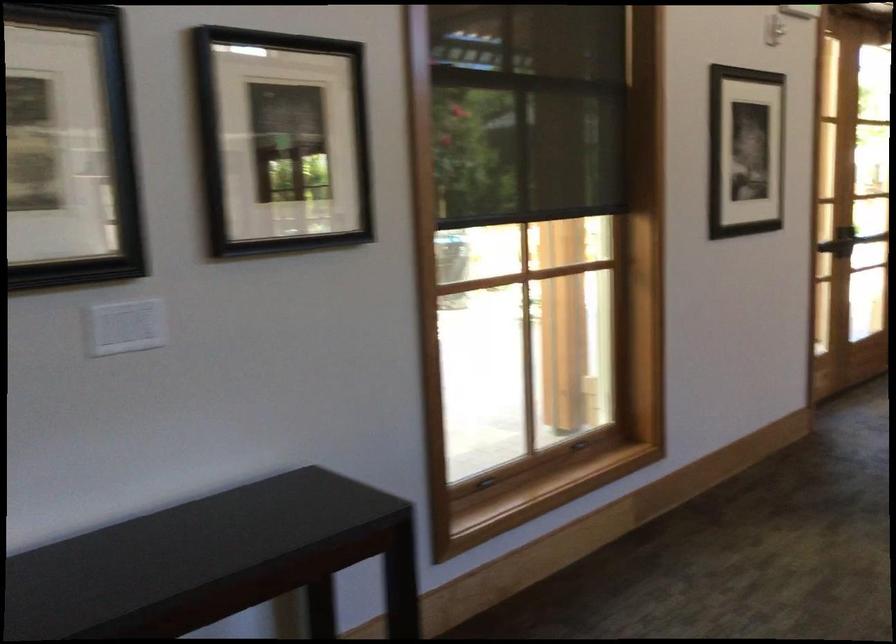
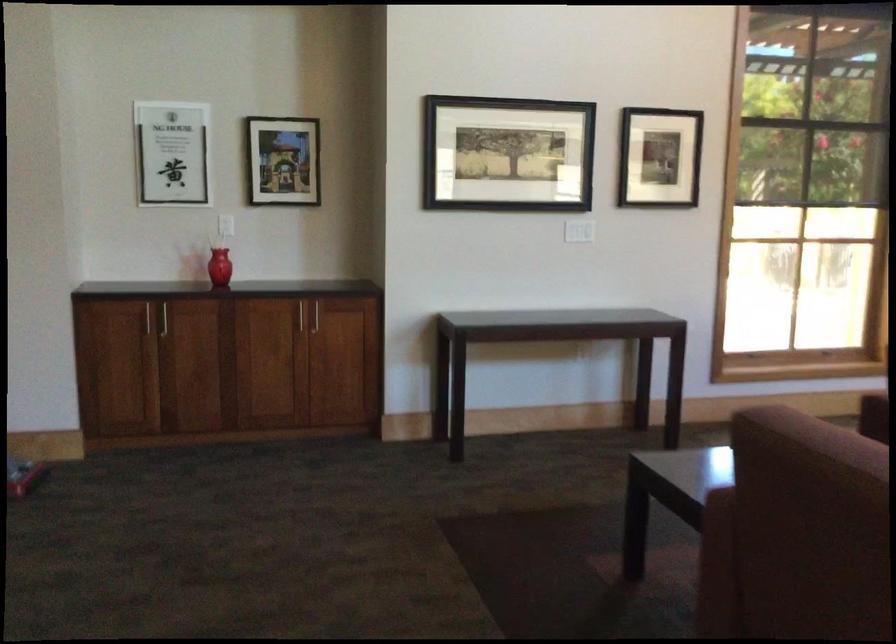
Question: What movement of the cameraman would produce the second image?

Choices:
 (A) Left
 (B) Right
 (C) Forward
 (D) Backward

Answer: (D)